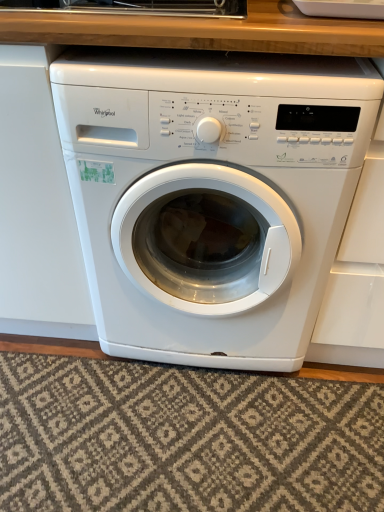
Measure the distance between white glossy washing machine at center and camera.

white glossy washing machine at center is 28.73 inches away from camera.

You are a GUI agent. You are given a task and a screenshot of the screen. Output one action in this format:
    pyautogui.click(x=<x>, y=<y>)
    Task: Click on the white glossy washing machine at center
    This screenshot has width=384, height=512.
    Given the screenshot: What is the action you would take?
    pyautogui.click(x=211, y=196)

What do you see at coordinates (211, 196) in the screenshot? I see `white glossy washing machine at center` at bounding box center [211, 196].

I want to click on textured beige rug at lower center, so click(184, 439).

This screenshot has width=384, height=512. What do you see at coordinates (184, 439) in the screenshot?
I see `textured beige rug at lower center` at bounding box center [184, 439].

Looking at this image, measure the distance between point (294, 448) and camera.

Point (294, 448) and camera are 1.09 meters apart.

Locate an element on the screen. white glossy washing machine at center is located at coordinates (211, 196).

Which object is positioned more to the right, textured beige rug at lower center or white glossy washing machine at center?

white glossy washing machine at center.

Is textured beige rug at lower center positioned before white glossy washing machine at center?

No, the depth of textured beige rug at lower center is greater than that of white glossy washing machine at center.

Which point is more forward, (272, 422) or (284, 105)?

Point (284, 105)

From the image's perspective, relative to white glossy washing machine at center, is textured beige rug at lower center above or below?

Based on their image positions, textured beige rug at lower center is located beneath white glossy washing machine at center.

From a real-world perspective, is textured beige rug at lower center below white glossy washing machine at center?

Indeed, from a real-world perspective, textured beige rug at lower center is positioned beneath white glossy washing machine at center.

Based on the photo, which of these two, textured beige rug at lower center or white glossy washing machine at center, is thinner?

Thinner between the two is textured beige rug at lower center.

In terms of height, does textured beige rug at lower center look taller or shorter compared to white glossy washing machine at center?

Considering their sizes, textured beige rug at lower center has less height than white glossy washing machine at center.

Between textured beige rug at lower center and white glossy washing machine at center, which one has larger size?

With larger size is white glossy washing machine at center.

Is textured beige rug at lower center situated inside white glossy washing machine at center or outside?

textured beige rug at lower center lies outside white glossy washing machine at center.

Would you say textured beige rug at lower center is a long distance from white glossy washing machine at center?

textured beige rug at lower center is near white glossy washing machine at center, not far away.

Could you tell me if textured beige rug at lower center is facing white glossy washing machine at center?

No, textured beige rug at lower center is not turned towards white glossy washing machine at center.

How many degrees apart are the facing directions of textured beige rug at lower center and white glossy washing machine at center?

0.303 degrees separate the facing orientations of textured beige rug at lower center and white glossy washing machine at center.

Measure the distance from textured beige rug at lower center to white glossy washing machine at center.

A distance of 40.19 centimeters exists between textured beige rug at lower center and white glossy washing machine at center.

Find the location of `mat on the left of white glossy washing machine at center`. mat on the left of white glossy washing machine at center is located at coordinates (184, 439).

Is white glossy washing machine at center to the left of textured beige rug at lower center from the viewer's perspective?

No, white glossy washing machine at center is not to the left of textured beige rug at lower center.

Is white glossy washing machine at center positioned behind textured beige rug at lower center?

No, the depth of white glossy washing machine at center is less than that of textured beige rug at lower center.

Is point (229, 221) farther from viewer compared to point (90, 449)?

That is True.

From the image's perspective, between white glossy washing machine at center and textured beige rug at lower center, who is located below?

textured beige rug at lower center, from the image's perspective.

From a real-world perspective, is white glossy washing machine at center above or below textured beige rug at lower center?

From a real-world perspective, white glossy washing machine at center is physically above textured beige rug at lower center.

Is white glossy washing machine at center thinner than textured beige rug at lower center?

In fact, white glossy washing machine at center might be wider than textured beige rug at lower center.

In terms of height, does white glossy washing machine at center look taller or shorter compared to textured beige rug at lower center?

Considering their sizes, white glossy washing machine at center has more height than textured beige rug at lower center.

Based on their sizes in the image, would you say white glossy washing machine at center is bigger or smaller than textured beige rug at lower center?

white glossy washing machine at center is bigger than textured beige rug at lower center.

Is white glossy washing machine at center outside of textured beige rug at lower center?

Yes, white glossy washing machine at center is outside of textured beige rug at lower center.

Are white glossy washing machine at center and textured beige rug at lower center making contact?

No, white glossy washing machine at center is not touching textured beige rug at lower center.

Is white glossy washing machine at center positioned with its back to textured beige rug at lower center?

No, textured beige rug at lower center is not at the back of white glossy washing machine at center.

How much distance is there between white glossy washing machine at center and textured beige rug at lower center?

white glossy washing machine at center is 15.82 inches away from textured beige rug at lower center.

The height and width of the screenshot is (512, 384). In order to click on mat on the left of white glossy washing machine at center in this screenshot , I will do `click(184, 439)`.

Find the location of a particular element. The width and height of the screenshot is (384, 512). washing machine on the right of textured beige rug at lower center is located at coordinates (211, 196).

Locate an element on the screen. This screenshot has width=384, height=512. mat below the white glossy washing machine at center (from a real-world perspective) is located at coordinates (184, 439).